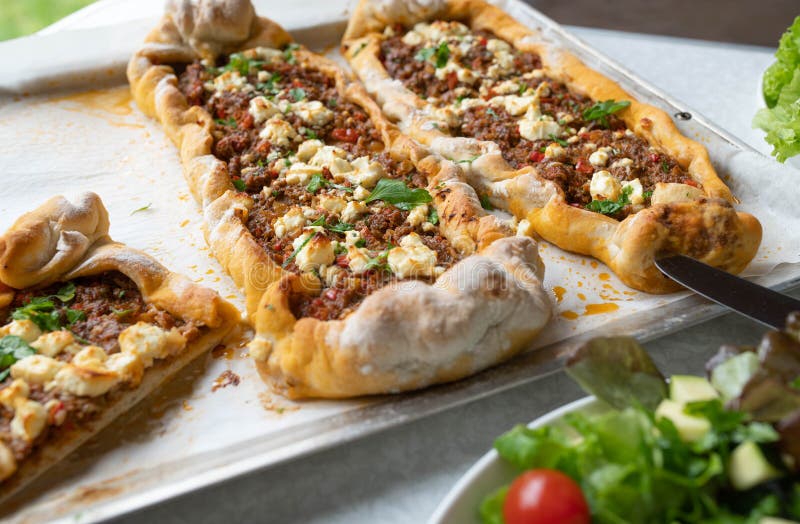
You are a GUI agent. You are given a task and a screenshot of the screen. Output one action in this format:
    pyautogui.click(x=<x>, y=<y>)
    Task: Click on the serving plate
    
    Given the screenshot: What is the action you would take?
    pyautogui.click(x=114, y=176)